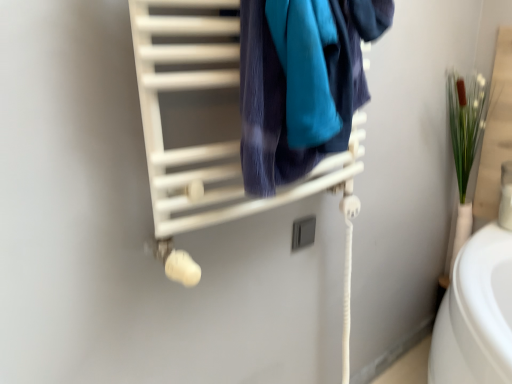
Question: Looking at their shapes, would you say velvety blue towel at center is wider or thinner than matte white towel rack at upper center?

Choices:
 (A) wide
 (B) thin

Answer: (A)

Question: Does point (262, 145) appear closer or farther from the camera than point (181, 4)?

Choices:
 (A) farther
 (B) closer

Answer: (B)

Question: Is velvety blue towel at center bigger or smaller than matte white towel rack at upper center?

Choices:
 (A) small
 (B) big

Answer: (B)

Question: Considering their positions, is matte white towel rack at upper center located in front of or behind velvety blue towel at center?

Choices:
 (A) front
 (B) behind

Answer: (A)

Question: From a real-world perspective, is matte white towel rack at upper center physically located above or below velvety blue towel at center?

Choices:
 (A) above
 (B) below

Answer: (B)

Question: From the image's perspective, relative to velvety blue towel at center, is matte white towel rack at upper center above or below?

Choices:
 (A) above
 (B) below

Answer: (B)

Question: Considering the positions of point (242, 190) and point (284, 77), is point (242, 190) closer or farther from the camera than point (284, 77)?

Choices:
 (A) closer
 (B) farther

Answer: (B)